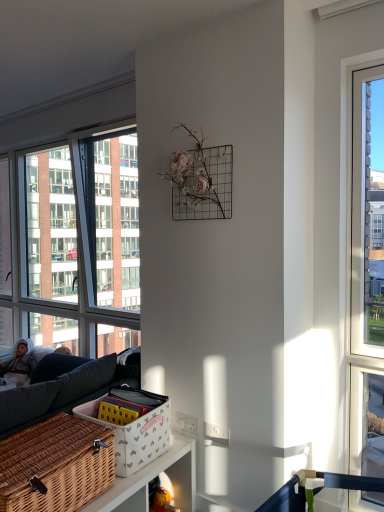
Question: Is clear glass window at left not inside fluffy white doll at left?

Choices:
 (A) yes
 (B) no

Answer: (A)

Question: Does clear glass window at left have a smaller size compared to fluffy white doll at left?

Choices:
 (A) yes
 (B) no

Answer: (B)

Question: Does clear glass window at left lie behind fluffy white doll at left?

Choices:
 (A) no
 (B) yes

Answer: (A)

Question: Are clear glass window at left and fluffy white doll at left beside each other?

Choices:
 (A) no
 (B) yes

Answer: (A)

Question: Considering the relative sizes of clear glass window at left and fluffy white doll at left in the image provided, is clear glass window at left shorter than fluffy white doll at left?

Choices:
 (A) no
 (B) yes

Answer: (A)

Question: Is clear glass window at left far away from fluffy white doll at left?

Choices:
 (A) no
 (B) yes

Answer: (A)

Question: From the image's perspective, is fluffy white doll at left beneath clear glass window at left?

Choices:
 (A) no
 (B) yes

Answer: (B)

Question: From a real-world perspective, is fluffy white doll at left physically below clear glass window at left?

Choices:
 (A) yes
 (B) no

Answer: (A)

Question: Is clear glass window at left completely or partially inside fluffy white doll at left?

Choices:
 (A) no
 (B) yes

Answer: (A)

Question: Can you confirm if fluffy white doll at left is thinner than clear glass window at left?

Choices:
 (A) no
 (B) yes

Answer: (A)

Question: Is fluffy white doll at left not inside clear glass window at left?

Choices:
 (A) no
 (B) yes

Answer: (B)

Question: Is fluffy white doll at left placed right next to clear glass window at left?

Choices:
 (A) no
 (B) yes

Answer: (A)

Question: Is woven brown picnic basket at lower left looking in the opposite direction of fluffy white doll at left?

Choices:
 (A) no
 (B) yes

Answer: (A)